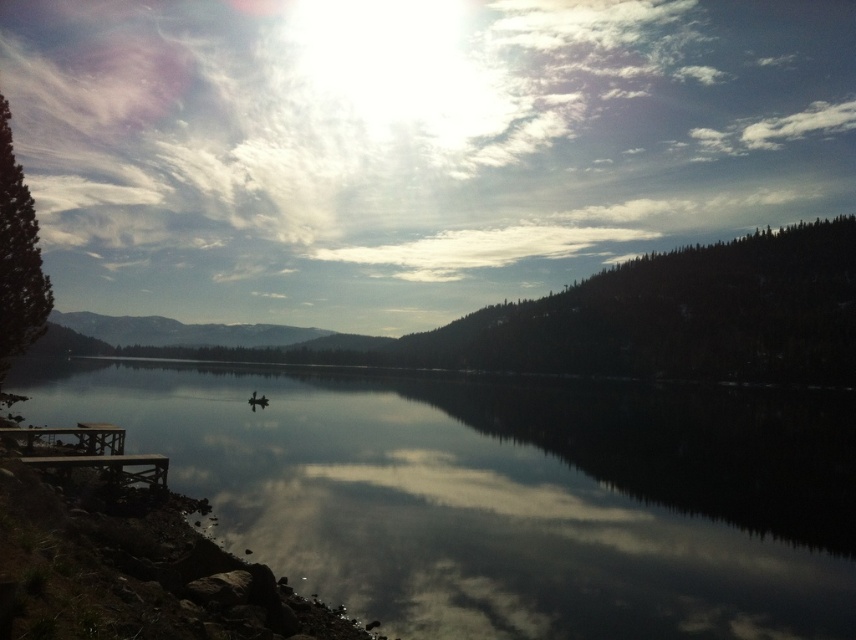
Consider the image. Is smooth dark water at center wider than wooden picnic table at lower left?

Yes, smooth dark water at center is wider than wooden picnic table at lower left.

Consider the image. Is smooth dark water at center smaller than wooden picnic table at lower left?

No.

Does point (730, 536) come behind point (111, 442)?

That is True.

The height and width of the screenshot is (640, 856). In order to click on smooth dark water at center in this screenshot , I will do pos(506,496).